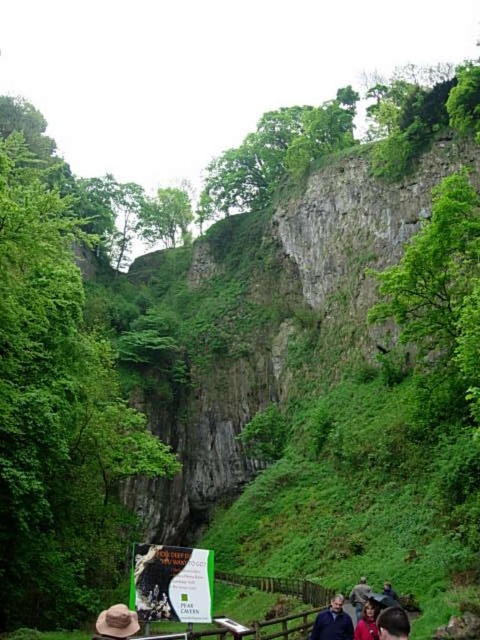
The image size is (480, 640). Describe the element at coordinates (171, 582) in the screenshot. I see `white paper sign at center` at that location.

Is white paper sign at center above dark brown leather jacket at lower right?

Yes, white paper sign at center is above dark brown leather jacket at lower right.

Is point (207, 577) farther from viewer compared to point (357, 611)?

No, it is in front of (357, 611).

The width and height of the screenshot is (480, 640). Identify the location of white paper sign at center. (171, 582).

Between white paper sign at center and red fabric jacket at lower right, which one is positioned lower?

red fabric jacket at lower right

Who is more distant from viewer, (173,573) or (371,609)?

Point (173,573)

The height and width of the screenshot is (640, 480). What do you see at coordinates (171, 582) in the screenshot?
I see `white paper sign at center` at bounding box center [171, 582].

You are a GUI agent. You are given a task and a screenshot of the screen. Output one action in this format:
    pyautogui.click(x=<x>, y=<y>)
    Task: Click on the white paper sign at center
    The height and width of the screenshot is (640, 480).
    Given the screenshot: What is the action you would take?
    171,582

Which is in front, point (357, 627) or point (365, 592)?

Point (357, 627) is more forward.

Based on the photo, does red fabric jacket at lower right have a greater width compared to dark brown leather jacket at lower right?

Yes, red fabric jacket at lower right is wider than dark brown leather jacket at lower right.

Is point (373, 624) less distant than point (351, 604)?

Yes.

Identify the location of red fabric jacket at lower right. (367, 621).